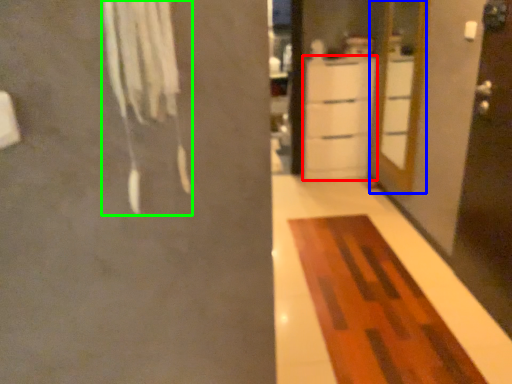
Question: Which object is the farthest from cabinetry (highlighted by a red box)? Choose among these: door (highlighted by a blue box) or laundry (highlighted by a green box).

Choices:
 (A) door
 (B) laundry

Answer: (B)